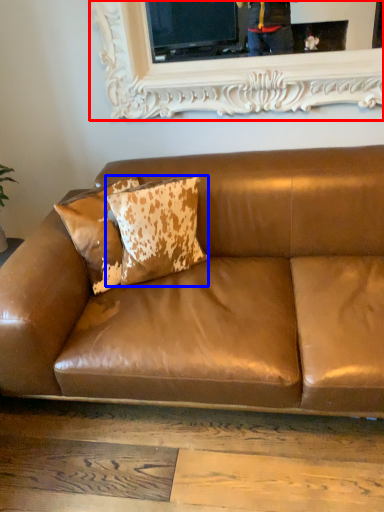
Question: Which point is further to the camera, picture frame (highlighted by a red box) or pillow (highlighted by a blue box)?

Choices:
 (A) picture frame
 (B) pillow

Answer: (A)